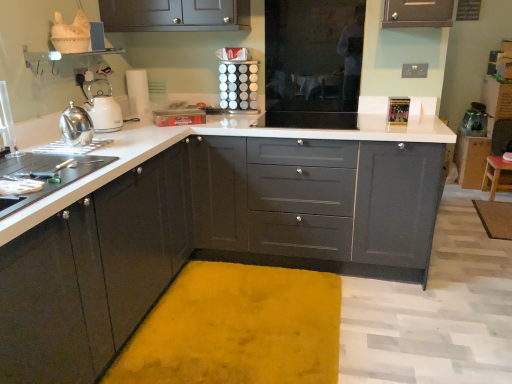
This screenshot has height=384, width=512. What are the coordinates of `vacant space to the right of shiny metallic kettle at left, acting as the first kitchen appliance starting from the front` in the screenshot? It's located at (119, 146).